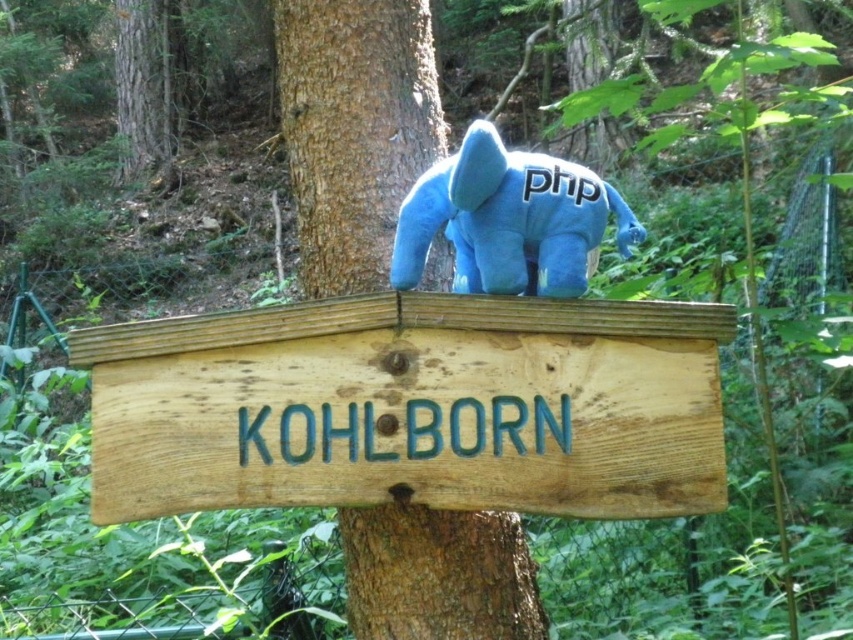
You are a hiker who wants to hang a small keychain on the tree trunk. You have two options to choose from the image. Which object between the brown rough wood sign at center and the blue plush toy at center would you choose to hang the keychain on, considering their thickness?

The brown rough wood sign at center is thinner than the blue plush toy at center, so the keychain would be easier to hang on the brown rough wood sign at center since it requires less space.

You are a hiker who wants to take a photo of the brown rough wood sign at center and the blue plush toy at center. Which object should you focus on first if you want to capture both in a single frame without moving the camera?

You should focus on the brown rough wood sign at center first because it is smaller in size compared to the blue plush toy at center, allowing you to frame both effectively by ensuring the smaller object is centered and the larger one is positioned around it.